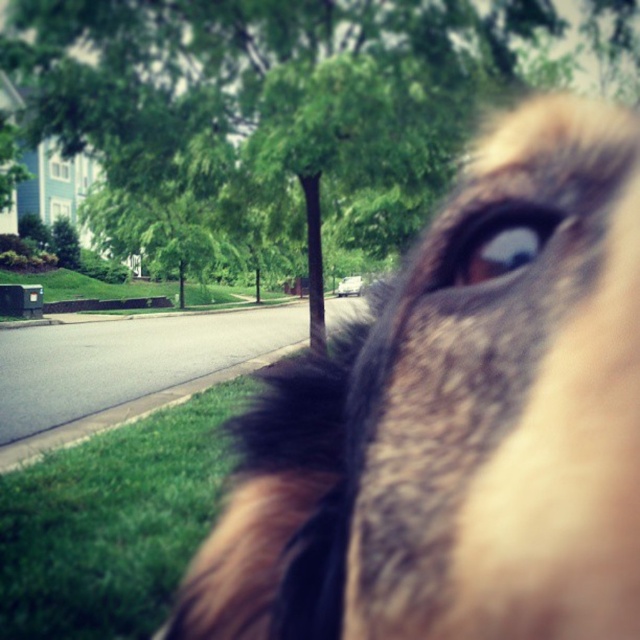
Is the position of green leafy tree at center more distant than that of brown fur eye at upper right?

Yes, green leafy tree at center is further from the viewer.

Which of these two, green leafy tree at center or brown fur eye at upper right, stands taller?

→ With more height is green leafy tree at center.

Which is in front, point (310, 157) or point (483, 256)?

Point (483, 256) is in front.

Where is `green leafy tree at center`? green leafy tree at center is located at coordinates (268, 88).

What do you see at coordinates (458, 420) in the screenshot?
I see `brown furry dog at upper right` at bounding box center [458, 420].

Does brown furry dog at upper right have a greater height compared to green leafy tree at center?

In fact, brown furry dog at upper right may be shorter than green leafy tree at center.

Does point (627, 232) come in front of point (468, 131)?

Yes.

Find the location of a particular element. The width and height of the screenshot is (640, 640). brown furry dog at upper right is located at coordinates (458, 420).

The width and height of the screenshot is (640, 640). I want to click on brown furry dog at upper right, so click(x=458, y=420).